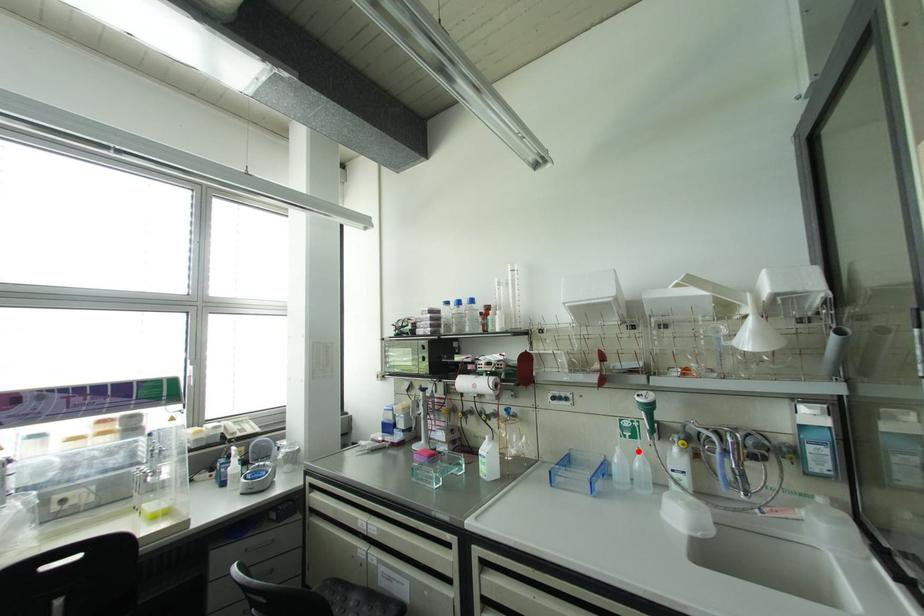
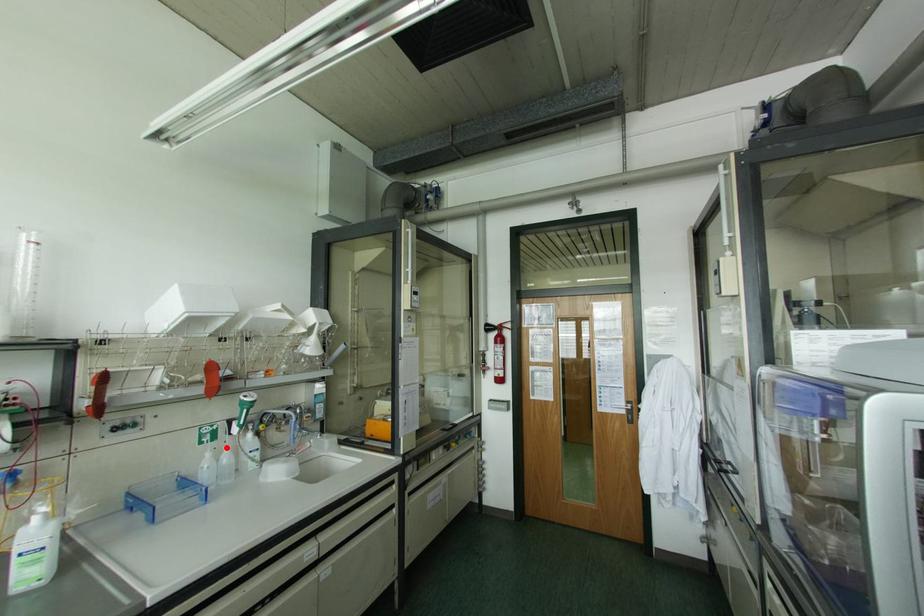
I am providing you with two images of the same scene from different viewpoints. A red point is marked on the first image and another point is marked on the second image. Do the highlighted points in image1 and image2 indicate the same real-world spot?

Yes